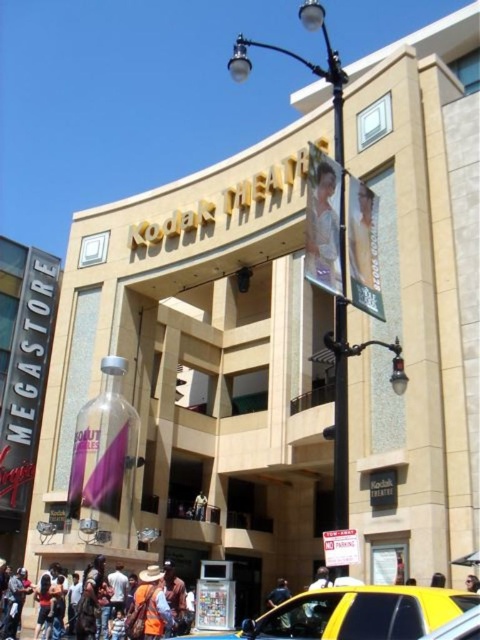
Is yellow rubber taxi at lower center positioned behind camouflage-patterned shirt at center?

No, it is in front of camouflage-patterned shirt at center.

Is yellow rubber taxi at lower center bigger than camouflage-patterned shirt at center?

Yes, yellow rubber taxi at lower center is bigger than camouflage-patterned shirt at center.

Describe the element at coordinates (355, 614) in the screenshot. I see `yellow rubber taxi at lower center` at that location.

The width and height of the screenshot is (480, 640). I want to click on yellow rubber taxi at lower center, so click(x=355, y=614).

Can you confirm if white glossy dress at upper center is wider than camouflage-patterned shirt at center?

No.

Between white glossy dress at upper center and camouflage-patterned shirt at center, which one has more height?

white glossy dress at upper center is taller.

Is point (317, 186) less distant than point (171, 618)?

That is True.

You are a GUI agent. You are given a task and a screenshot of the screen. Output one action in this format:
    pyautogui.click(x=<x>, y=<y>)
    Task: Click on the white glossy dress at upper center
    The image size is (480, 640).
    Given the screenshot: What is the action you would take?
    pyautogui.click(x=323, y=221)

Is point (156, 609) more distant than point (288, 620)?

Yes.

The image size is (480, 640). Identify the location of camouflage-patterned shirt at center. (149, 605).